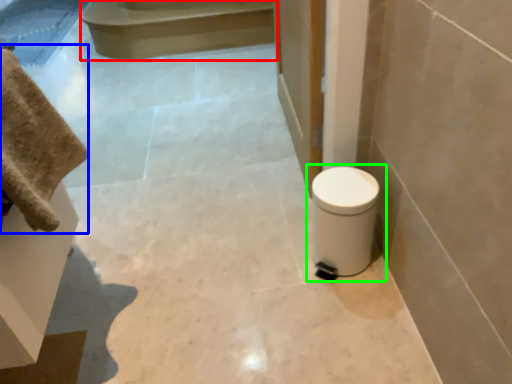
Question: Considering the real-world distances, which object is farthest from stair (highlighted by a red box)? bath towel (highlighted by a blue box) or toilet (highlighted by a green box)?

Choices:
 (A) bath towel
 (B) toilet

Answer: (A)